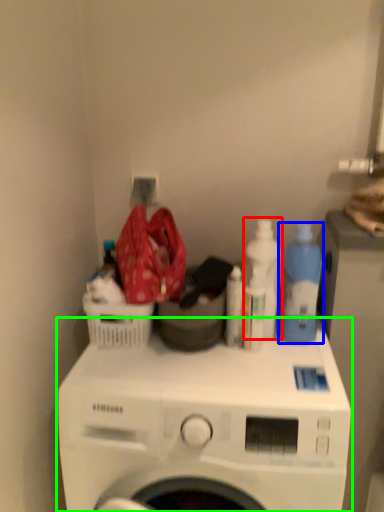
Question: Based on their relative distances, which object is farther from cleaning product (highlighted by a red box)? Choose from cleaning product (highlighted by a blue box) and washing machine (highlighted by a green box).

Choices:
 (A) cleaning product
 (B) washing machine

Answer: (B)